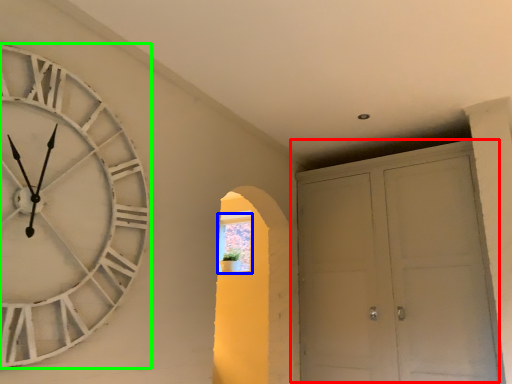
Question: Considering the real-world distances, which object is farthest from door (highlighted by a red box)? window (highlighted by a blue box) or wall clock (highlighted by a green box)?

Choices:
 (A) window
 (B) wall clock

Answer: (B)